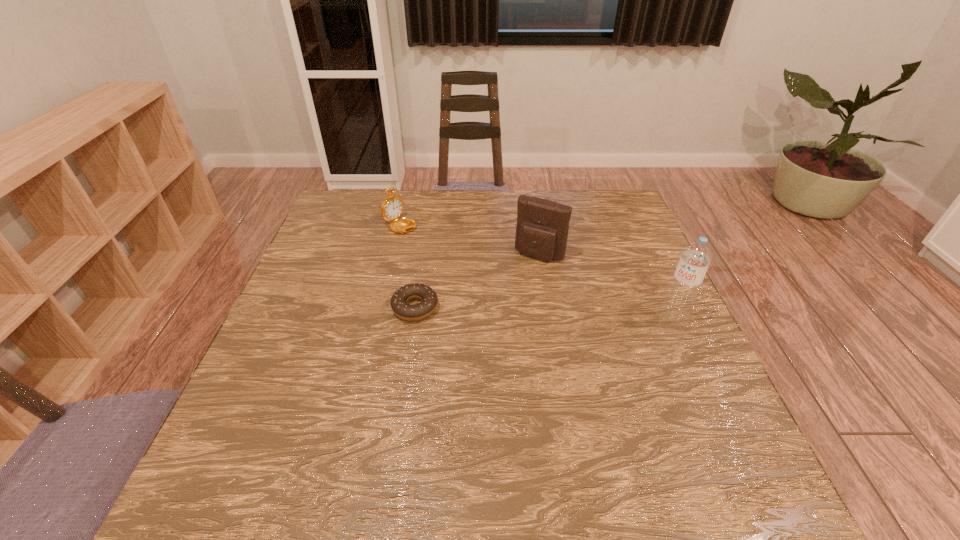
Identify the location of doughnut. This screenshot has height=540, width=960. (398, 302).

The width and height of the screenshot is (960, 540). I want to click on the rightmost object, so click(696, 257).

At what (x,y) coordinates should I click in order to perform the action: click on the tallest object. Please return your answer as a coordinate pair (x, y). This screenshot has height=540, width=960. Looking at the image, I should click on (696, 257).

At what (x,y) coordinates should I click in order to perform the action: click on the third shortest object. Please return your answer as a coordinate pair (x, y). The height and width of the screenshot is (540, 960). Looking at the image, I should click on (542, 228).

The height and width of the screenshot is (540, 960). In order to click on the third object from left to right in this screenshot , I will do `click(542, 228)`.

This screenshot has width=960, height=540. I want to click on the farthest object, so click(392, 207).

The width and height of the screenshot is (960, 540). Find the location of `pocket watch`. pocket watch is located at coordinates pos(392,207).

Find the location of a particular element. This screenshot has width=960, height=540. vacant space located 0.060m on the right of the doughnut is located at coordinates (463, 308).

Identify the location of blank space located on the back of the water bottle. (647, 258).

Where is `vacant space located 0.310m with an open flap on the third nearest object`? The image size is (960, 540). vacant space located 0.310m with an open flap on the third nearest object is located at coordinates (483, 344).